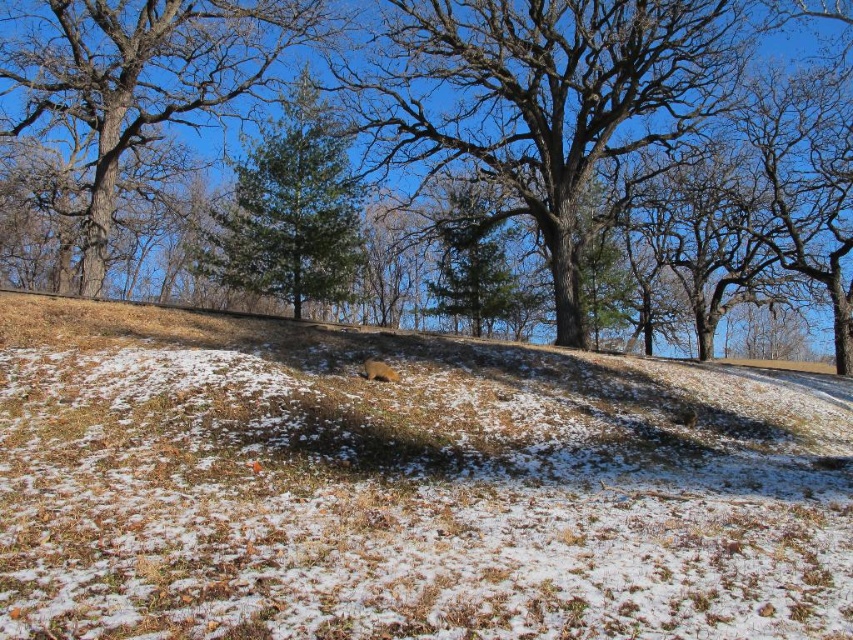
Does brown textured tree at center appear over green pine tree at center?

No, brown textured tree at center is not above green pine tree at center.

Who is more distant from viewer, (593, 83) or (283, 259)?

Point (283, 259)

The height and width of the screenshot is (640, 853). What are the coordinates of `brown textured tree at center` in the screenshot? It's located at (437, 157).

Can you confirm if brown grass at center is smaller than brown textured tree at center?

Yes, brown grass at center is smaller than brown textured tree at center.

Between brown grass at center and brown textured tree at center, which one appears on the left side from the viewer's perspective?

brown textured tree at center is more to the left.

Who is more forward, (355, 413) or (793, 266)?

Point (355, 413)

Find the location of `brown grass at center`. brown grass at center is located at coordinates (404, 486).

Is green needle-like at upper center to the left of green pine tree at center from the viewer's perspective?

Yes, green needle-like at upper center is to the left of green pine tree at center.

Which is behind, point (97, 26) or point (281, 296)?

The point (281, 296) is behind.

Identify the location of green needle-like at upper center. Image resolution: width=853 pixels, height=640 pixels. (144, 76).